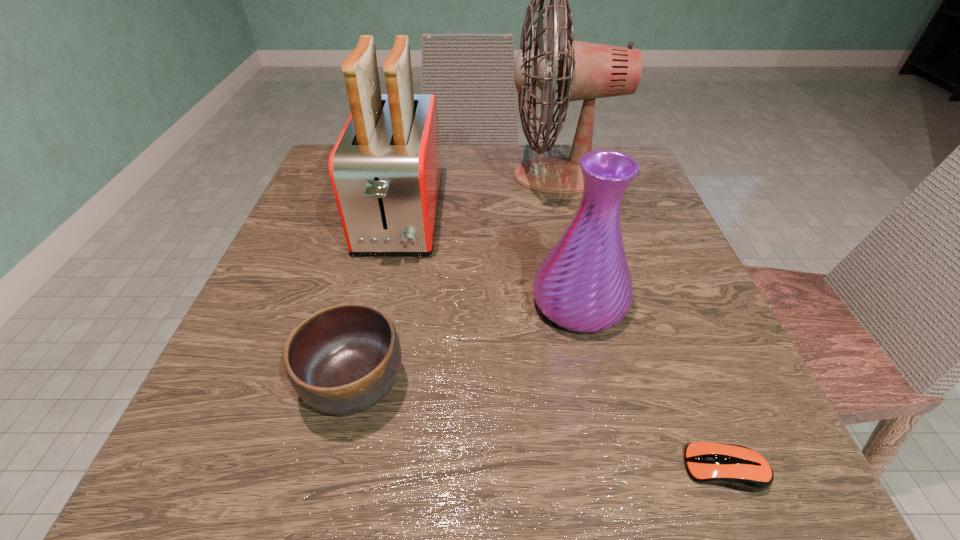
In order to click on free spot at the right edge of the desktop in this screenshot , I will do `click(679, 281)`.

Identify the location of vacant space at the far left corner of the desktop. The height and width of the screenshot is (540, 960). (319, 194).

The height and width of the screenshot is (540, 960). In the image, there is a desktop. Find the location of `vacant space at the near left corner`. vacant space at the near left corner is located at coordinates (199, 440).

Locate an element on the screen. This screenshot has height=540, width=960. free location at the far right corner of the desktop is located at coordinates (595, 145).

The width and height of the screenshot is (960, 540). Find the location of `unoccupied position between the computer mouse and the tallest object`. unoccupied position between the computer mouse and the tallest object is located at coordinates (642, 322).

Locate an element on the screen. unoccupied position between the shortest object and the second nearest object is located at coordinates (540, 427).

Where is `blank region between the fan and the shortest object`? blank region between the fan and the shortest object is located at coordinates (642, 322).

Identify the location of vacant area between the tallest object and the computer mouse. (642, 322).

Find the location of a particular element. This screenshot has height=540, width=960. free space between the fan and the fourth farthest object is located at coordinates (458, 281).

Where is `unoccupied position between the toaster and the fan`? This screenshot has width=960, height=540. unoccupied position between the toaster and the fan is located at coordinates (480, 196).